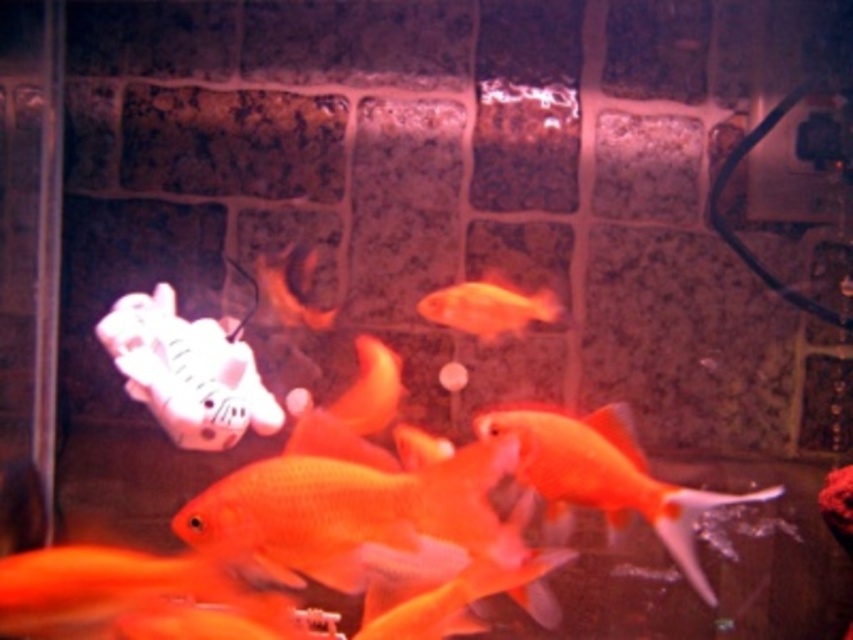
What do you see at coordinates (604, 477) in the screenshot? I see `glossy orange goldfish at center` at bounding box center [604, 477].

Locate an element on the screen. glossy orange goldfish at center is located at coordinates (604, 477).

Who is more forward, [618,449] or [485,314]?

Point [618,449] is more forward.

Locate an element on the screen. This screenshot has height=640, width=853. glossy orange goldfish at center is located at coordinates (604, 477).